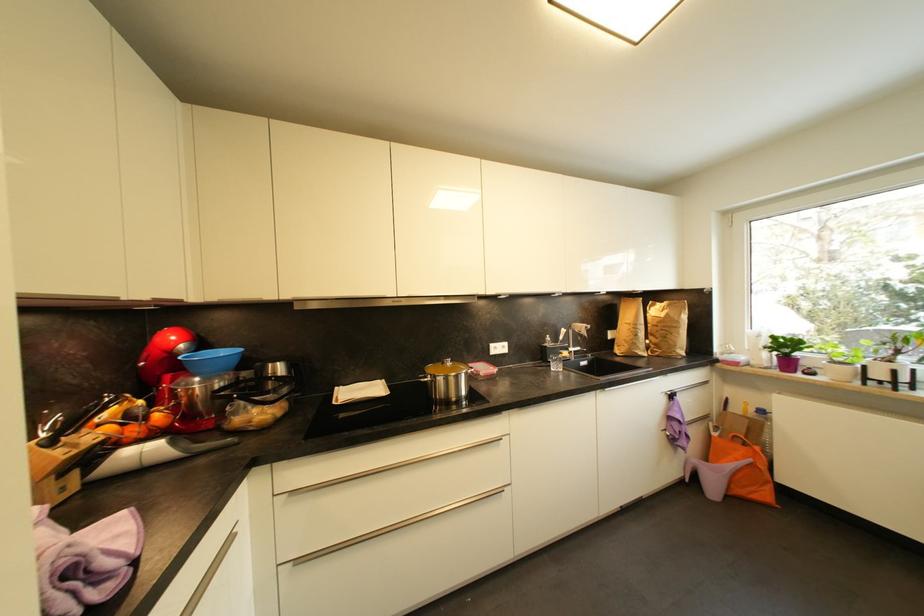
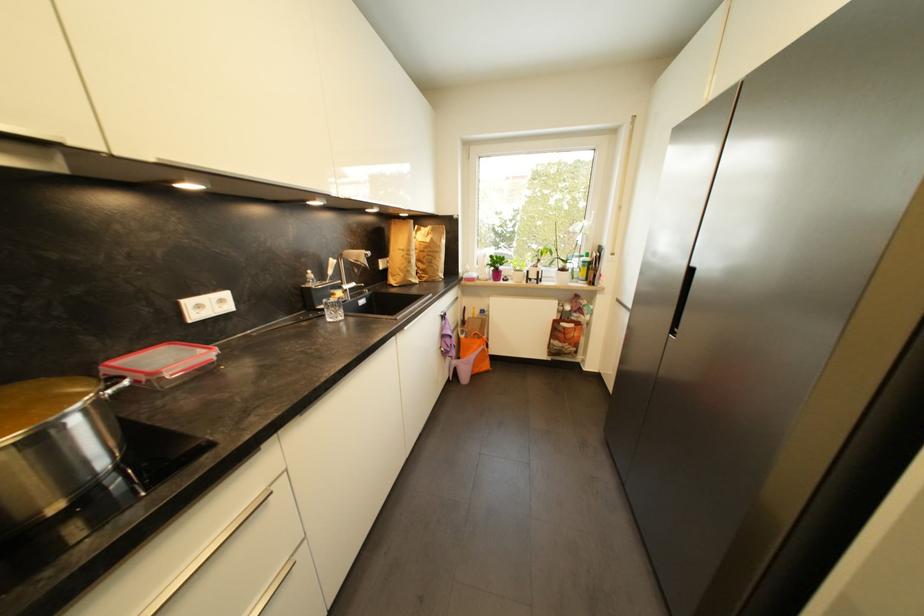
In the second image, find the point that corresponds to point (663, 323) in the first image.

(430, 249)